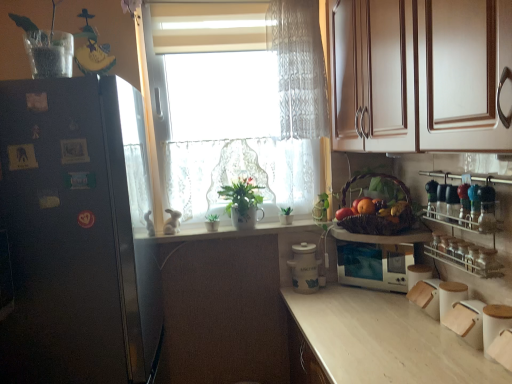
Identify the location of vacant space positioned to the left of green matte houseplant at center, the third houseplant when ordered from right to left. The height and width of the screenshot is (384, 512). (189, 231).